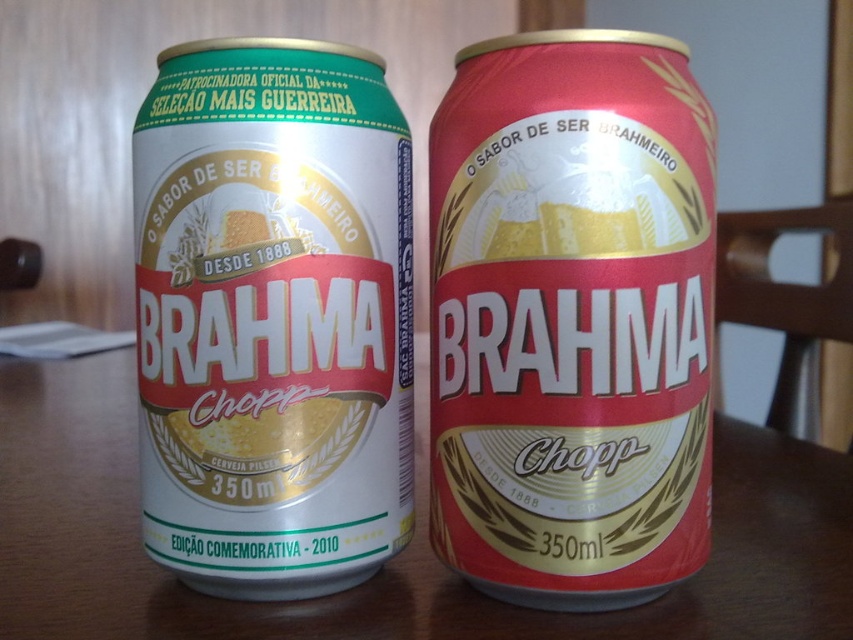
Does matte red can at center have a greater width compared to white matte can at center?

No, matte red can at center is not wider than white matte can at center.

Can you confirm if matte red can at center is bigger than white matte can at center?

Yes, matte red can at center is bigger than white matte can at center.

Where is `matte red can at center`? The width and height of the screenshot is (853, 640). matte red can at center is located at coordinates (572, 317).

Does white matte can at center lie in front of wooden table at center?

No, white matte can at center is behind wooden table at center.

Consider the image. Who is taller, white matte can at center or wooden table at center?

With more height is white matte can at center.

The height and width of the screenshot is (640, 853). In order to click on white matte can at center in this screenshot , I will do `click(273, 316)`.

Who is lower down, matte red can at center or wooden table at center?

wooden table at center is lower down.

From the picture: Who is taller, matte red can at center or wooden table at center?

Standing taller between the two is matte red can at center.

This screenshot has width=853, height=640. Describe the element at coordinates (572, 317) in the screenshot. I see `matte red can at center` at that location.

Where is `matte red can at center`? Image resolution: width=853 pixels, height=640 pixels. matte red can at center is located at coordinates [572, 317].